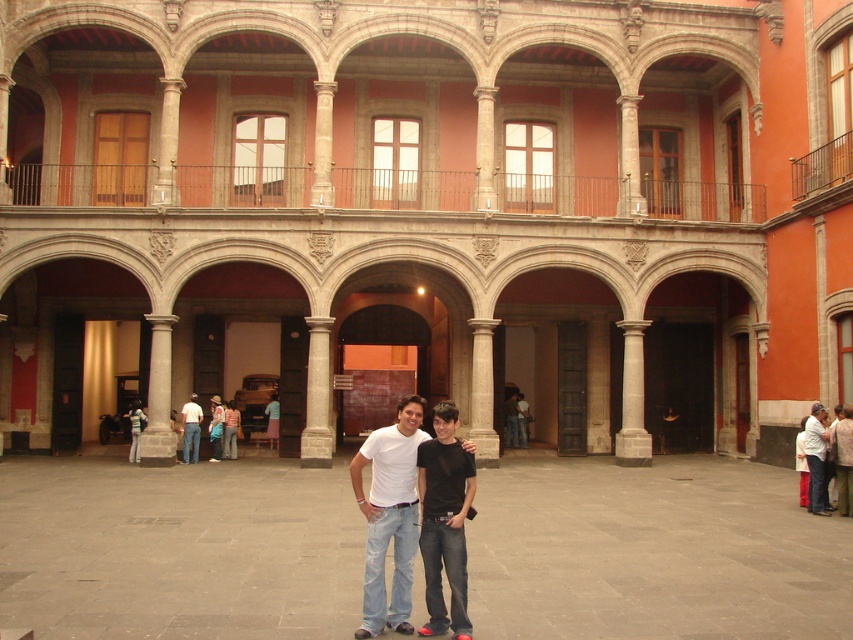
Question: Can you confirm if white matte t-shirt at center is positioned below white cotton shirt at center?

Choices:
 (A) no
 (B) yes

Answer: (A)

Question: Considering the relative positions of smooth stone courtyard at center and denim jacket at center in the image provided, where is smooth stone courtyard at center located with respect to denim jacket at center?

Choices:
 (A) right
 (B) left

Answer: (A)

Question: Among these points, which one is farthest from the camera?

Choices:
 (A) (456, 634)
 (B) (850, 556)
 (C) (805, 448)

Answer: (C)

Question: In this image, where is white matte t-shirt at center located relative to white cotton shirt at center?

Choices:
 (A) right
 (B) left

Answer: (B)

Question: Among these points, which one is nearest to the camera?

Choices:
 (A) (20, 596)
 (B) (453, 476)
 (C) (380, 595)

Answer: (C)

Question: Which object appears farthest from the camera in this image?

Choices:
 (A) black cotton shirt at center
 (B) white t-shirt at center

Answer: (B)